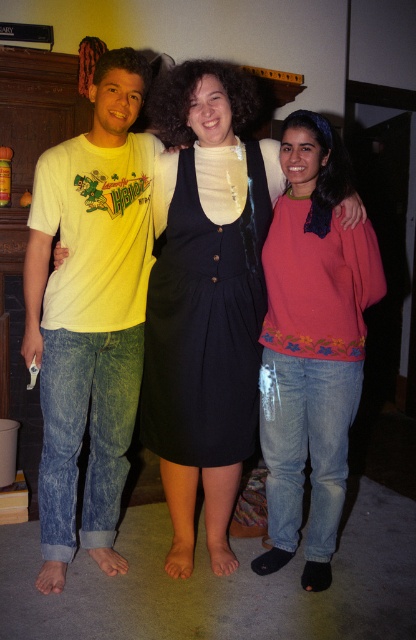
You are standing in the living room and want to place a small potted plant between the two points marked as point (116, 344) and point (232, 291). Considering their positions, which point should the plant be closer to so it doesn not block the path in front of the center person?

The plant should be placed closer to point (232, 291) because point (116, 344) is behind point (232, 291), so placing it closer to the front point would keep it from blocking the path in front of the center person.